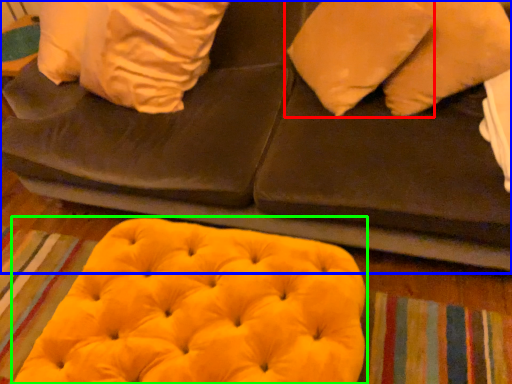
Question: Based on their relative distances, which object is farther from pillow (highlighted by a red box)? Choose from furniture (highlighted by a blue box) and bean bag chair (highlighted by a green box).

Choices:
 (A) furniture
 (B) bean bag chair

Answer: (B)